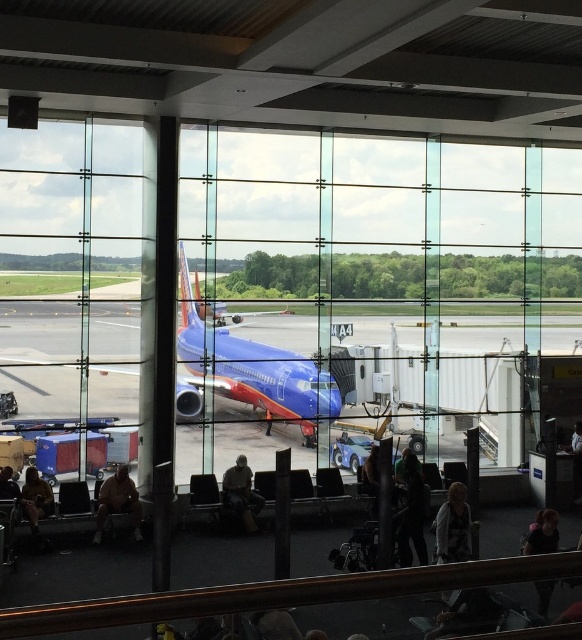
Who is more forward, (x=243, y=512) or (x=37, y=532)?

Positioned in front is point (x=37, y=532).

In the scene shown: Is camouflage fabric jacket at center closer to camera compared to brown leather jacket at lower left?

No, camouflage fabric jacket at center is further to the viewer.

Which is behind, point (239, 500) or point (51, 497)?

Positioned behind is point (239, 500).

What are the coordinates of `camouflage fabric jacket at center` in the screenshot? It's located at (242, 492).

Between point (264, 376) and point (544, 580), which one is positioned behind?

The point (264, 376) is behind.

Does blue glossy airplane at center appear under dark brown leather jacket at lower right?

Incorrect, blue glossy airplane at center is not positioned below dark brown leather jacket at lower right.

This screenshot has height=640, width=582. Identify the location of blue glossy airplane at center. (250, 371).

Between dark green fabric jacket at center and brown leather jacket at lower left, which one is positioned higher?

brown leather jacket at lower left is above.

Is point (402, 509) positioned in front of point (36, 508)?

Yes.

Locate an element on the screen. Image resolution: width=582 pixels, height=640 pixels. dark green fabric jacket at center is located at coordinates point(411,513).

You are a GUI agent. You are given a task and a screenshot of the screen. Output one action in this format:
    pyautogui.click(x=<x>, y=<y>)
    Task: Click on the dark green fabric jacket at center
    This screenshot has width=582, height=640.
    Given the screenshot: What is the action you would take?
    pyautogui.click(x=411, y=513)